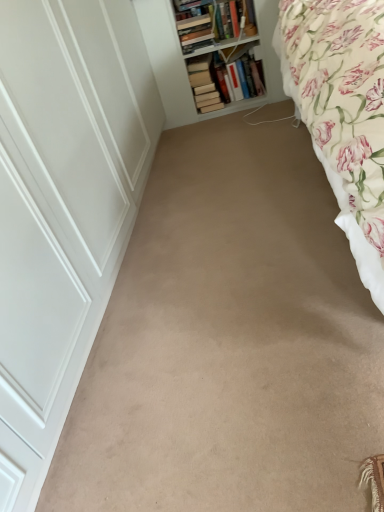
This screenshot has height=512, width=384. What do you see at coordinates (229, 341) in the screenshot?
I see `beige carpet at center` at bounding box center [229, 341].

This screenshot has height=512, width=384. Describe the element at coordinates (342, 112) in the screenshot. I see `floral cotton bed at right` at that location.

Describe the element at coordinates (204, 84) in the screenshot. I see `hardcover books at upper center, which is the 2th book from right to left` at that location.

Where is `hardcover book at upper center, the 3th book in the left-to-right sequence`? The image size is (384, 512). hardcover book at upper center, the 3th book in the left-to-right sequence is located at coordinates (223, 80).

From a real-world perspective, is floral cotton bed at right located higher than hardcover book at upper center, placed as the first book when sorted from left to right?

No, from a real-world perspective, floral cotton bed at right is not above hardcover book at upper center, placed as the first book when sorted from left to right.

Locate an element on the screen. The height and width of the screenshot is (512, 384). bed in front of the hardcover book at upper center, the third book in the right-to-left sequence is located at coordinates (342, 112).

In the scene shown: Between floral cotton bed at right and hardcover book at upper center, placed as the first book when sorted from left to right, which one is positioned behind?

hardcover book at upper center, placed as the first book when sorted from left to right, is further away from the camera.

Is floral cotton bed at right wider than hardcover book at upper center, the third book in the right-to-left sequence?

Yes, floral cotton bed at right is wider than hardcover book at upper center, the third book in the right-to-left sequence.

Does hardcover books at upper center, which is the 2th book from right to left, turn towards beige carpet at center?

Yes, hardcover books at upper center, which is the 2th book from right to left, is facing beige carpet at center.

Which of these two, hardcover books at upper center, which is the 2th book from right to left, or beige carpet at center, stands shorter?

Standing shorter between the two is beige carpet at center.

From the image's perspective, relative to beige carpet at center, is hardcover books at upper center, which is the second book from left to right, above or below?

hardcover books at upper center, which is the second book from left to right, is above beige carpet at center.

Is hardcover books at upper center, which is the second book from left to right, to the left or to the right of beige carpet at center in the image?

In the image, hardcover books at upper center, which is the second book from left to right, appears on the right side of beige carpet at center.

What's the angular difference between white wooden bookshelf at upper center and hardcover book at upper center, placed as the first book when sorted from left to right,'s facing directions?

0.00103 degrees separate the facing orientations of white wooden bookshelf at upper center and hardcover book at upper center, placed as the first book when sorted from left to right.

Between point (214, 103) and point (207, 42), which one is positioned in front?

The point (207, 42) is in front.

In the image, is white wooden bookshelf at upper center on the left side or the right side of hardcover book at upper center, placed as the first book when sorted from left to right?

white wooden bookshelf at upper center is to the right of hardcover book at upper center, placed as the first book when sorted from left to right.

Locate an element on the screen. The width and height of the screenshot is (384, 512). shelf on the right of hardcover book at upper center, the third book in the right-to-left sequence is located at coordinates (220, 51).

Between hardcover books at upper center, which is the second book from left to right, and floral cotton bed at right, which one has larger size?

floral cotton bed at right.

How many degrees apart are the facing directions of hardcover books at upper center, which is the second book from left to right, and floral cotton bed at right?

0.00133 degrees separate the facing orientations of hardcover books at upper center, which is the second book from left to right, and floral cotton bed at right.

Who is shorter, hardcover books at upper center, which is the 2th book from right to left, or floral cotton bed at right?

hardcover books at upper center, which is the 2th book from right to left.

Considering the positions of objects hardcover books at upper center, which is the second book from left to right, and floral cotton bed at right in the image provided, who is more to the right, hardcover books at upper center, which is the second book from left to right, or floral cotton bed at right?

floral cotton bed at right is more to the right.

In the image, there is a white wooden bookshelf at upper center. Where is `plain below it (from a real-world perspective)`? Image resolution: width=384 pixels, height=512 pixels. plain below it (from a real-world perspective) is located at coordinates (229, 341).

Considering the sizes of objects white wooden bookshelf at upper center and beige carpet at center in the image provided, who is taller, white wooden bookshelf at upper center or beige carpet at center?

Standing taller between the two is white wooden bookshelf at upper center.

Considering the relative positions of white wooden bookshelf at upper center and beige carpet at center in the image provided, is white wooden bookshelf at upper center to the left or to the right of beige carpet at center?

white wooden bookshelf at upper center is to the right of beige carpet at center.

Which object is thinner, white wooden bookshelf at upper center or beige carpet at center?

white wooden bookshelf at upper center.

From the image's perspective, is floral cotton bed at right over hardcover book at upper center, which appears as the first book when viewed from the right?

No.

Is floral cotton bed at right to the left or to the right of hardcover book at upper center, which appears as the first book when viewed from the right, in the image?

In the image, floral cotton bed at right appears on the right side of hardcover book at upper center, which appears as the first book when viewed from the right.

Who is bigger, floral cotton bed at right or hardcover book at upper center, which appears as the first book when viewed from the right?

floral cotton bed at right.

Is floral cotton bed at right wider or thinner than hardcover book at upper center, which appears as the first book when viewed from the right?

floral cotton bed at right is wider than hardcover book at upper center, which appears as the first book when viewed from the right.

Which object is closer to the camera, beige carpet at center or white wooden bookshelf at upper center?

beige carpet at center is more forward.

Is white wooden bookshelf at upper center surrounded by beige carpet at center?

Definitely not — white wooden bookshelf at upper center is not inside beige carpet at center.

Considering the positions of objects beige carpet at center and white wooden bookshelf at upper center in the image provided, who is more to the right, beige carpet at center or white wooden bookshelf at upper center?

white wooden bookshelf at upper center is more to the right.

From the image's perspective, which one is positioned lower, beige carpet at center or white wooden bookshelf at upper center?

beige carpet at center is shown below in the image.

Where is `bed located below the hardcover book at upper center, placed as the first book when sorted from left to right (from the image's perspective)`? Image resolution: width=384 pixels, height=512 pixels. bed located below the hardcover book at upper center, placed as the first book when sorted from left to right (from the image's perspective) is located at coordinates (342, 112).

What are the coordinates of `the 2nd book behind when counting from the beige carpet at center` in the screenshot? It's located at (204, 84).

From the image, which object appears to be farther from white wooden bookshelf at upper center, hardcover books at upper center, which is the second book from left to right, or floral cotton bed at right?

floral cotton bed at right lies further to white wooden bookshelf at upper center than the other object.

Estimate the real-world distances between objects in this image. Which object is closer to hardcover book at upper center, placed as the first book when sorted from left to right, white wooden bookshelf at upper center or floral cotton bed at right?

white wooden bookshelf at upper center is closer to hardcover book at upper center, placed as the first book when sorted from left to right.

Based on their spatial positions, is floral cotton bed at right or hardcover book at upper center, the third book in the right-to-left sequence, closer to white wooden bookshelf at upper center?

hardcover book at upper center, the third book in the right-to-left sequence.

From the image, which object appears to be farther from white wooden bookshelf at upper center, hardcover book at upper center, which appears as the first book when viewed from the right, or hardcover books at upper center, which is the 2th book from right to left?

The object further to white wooden bookshelf at upper center is hardcover books at upper center, which is the 2th book from right to left.

Estimate the real-world distances between objects in this image. Which object is closer to hardcover book at upper center, placed as the first book when sorted from left to right, white wooden bookshelf at upper center or hardcover books at upper center, which is the 2th book from right to left?

white wooden bookshelf at upper center is closer to hardcover book at upper center, placed as the first book when sorted from left to right.

Considering their positions, is beige carpet at center positioned further to hardcover book at upper center, the 3th book in the left-to-right sequence, than white wooden bookshelf at upper center?

Among the two, beige carpet at center is located further to hardcover book at upper center, the 3th book in the left-to-right sequence.

From the image, which object appears to be nearer to floral cotton bed at right, beige carpet at center or hardcover book at upper center, which appears as the first book when viewed from the right?

beige carpet at center lies closer to floral cotton bed at right than the other object.

Considering their positions, is hardcover book at upper center, the third book in the right-to-left sequence, positioned further to white wooden bookshelf at upper center than hardcover book at upper center, which appears as the first book when viewed from the right?

hardcover book at upper center, the third book in the right-to-left sequence, is positioned further to the anchor white wooden bookshelf at upper center.

The image size is (384, 512). In order to click on book located between white wooden bookshelf at upper center and hardcover books at upper center, which is the second book from left to right, in the depth direction in this screenshot , I will do `click(213, 22)`.

Locate an element on the screen. The width and height of the screenshot is (384, 512). book between hardcover book at upper center, placed as the first book when sorted from left to right, and hardcover books at upper center, which is the 2th book from right to left, from top to bottom is located at coordinates (223, 80).

At what (x,y) coordinates should I click in order to perform the action: click on shelf between beige carpet at center and hardcover books at upper center, which is the second book from left to right, from front to back. Please return your answer as a coordinate pair (x, y). This screenshot has width=384, height=512. Looking at the image, I should click on (220, 51).

You are a GUI agent. You are given a task and a screenshot of the screen. Output one action in this format:
    pyautogui.click(x=<x>, y=<y>)
    Task: Click on the book positioned between beige carpet at center and hardcover books at upper center, which is the 2th book from right to left, from near to far
    This screenshot has width=384, height=512.
    Given the screenshot: What is the action you would take?
    (213, 22)